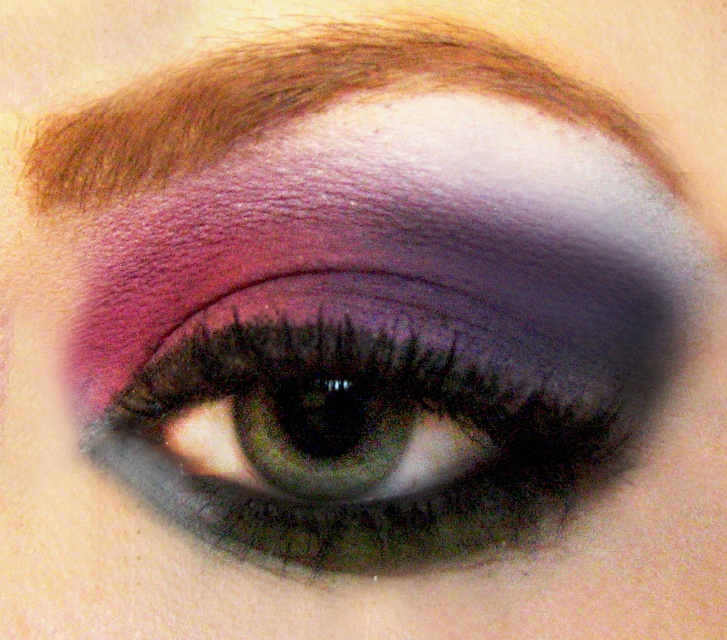
Is shimmering pink eyeshadow at center bigger than brown hair at upper center?

Indeed, shimmering pink eyeshadow at center has a larger size compared to brown hair at upper center.

Can you confirm if shimmering pink eyeshadow at center is smaller than brown hair at upper center?

Actually, shimmering pink eyeshadow at center might be larger than brown hair at upper center.

Who is more distant from viewer, (462, 436) or (225, 54)?

Positioned behind is point (462, 436).

Image resolution: width=727 pixels, height=640 pixels. In order to click on shimmering pink eyeshadow at center in this screenshot , I will do `click(385, 412)`.